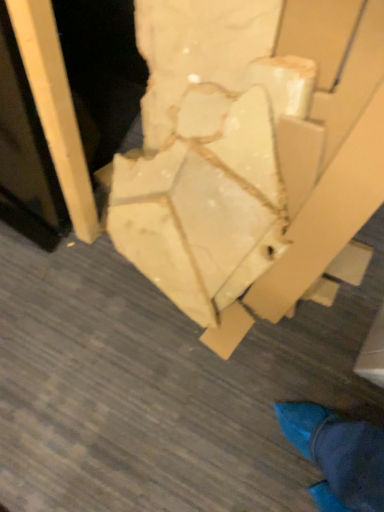
Identify the location of matte cardboard box at center. (252, 156).

What do you see at coordinates (252, 156) in the screenshot? I see `matte cardboard box at center` at bounding box center [252, 156].

Locate an element on the screen. This screenshot has height=512, width=384. matte cardboard box at center is located at coordinates (252, 156).